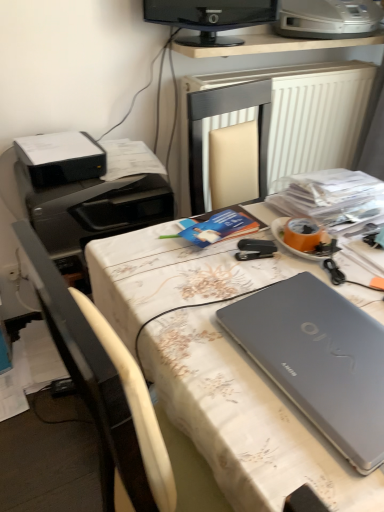
At what (x,y) coordinates should I click in order to perform the action: click on black plastic printer at upper left, arranged as the 2th printer when ordered from the bottom. Please return your answer as a coordinate pair (x, y). The width and height of the screenshot is (384, 512). Looking at the image, I should click on (61, 158).

Image resolution: width=384 pixels, height=512 pixels. What do you see at coordinates (61, 158) in the screenshot?
I see `black plastic printer at upper left, which is the third printer from right to left` at bounding box center [61, 158].

The image size is (384, 512). What are the coordinates of `white textured radiator at upper center` in the screenshot? It's located at (275, 120).

Where is `black glossy monitor at upper center`? The width and height of the screenshot is (384, 512). black glossy monitor at upper center is located at coordinates (210, 18).

Describe the element at coordinates (328, 18) in the screenshot. I see `silver metallic printer at upper right, which is counted as the 1th printer, starting from the right` at that location.

This screenshot has height=512, width=384. In order to click on white fabric-covered desk at center in this screenshot , I will do `click(244, 419)`.

Is white fabric-covered desk at center located within black plastic printer at upper left, arranged as the 2th printer when ordered from the bottom?

No, white fabric-covered desk at center is not inside black plastic printer at upper left, arranged as the 2th printer when ordered from the bottom.

Considering the sizes of objects black plastic printer at upper left, which is the third printer from right to left, and white fabric-covered desk at center in the image provided, who is shorter, black plastic printer at upper left, which is the third printer from right to left, or white fabric-covered desk at center?

With less height is black plastic printer at upper left, which is the third printer from right to left.

From a real-world perspective, is black plastic printer at upper left, which is the third printer from right to left, positioned under white fabric-covered desk at center based on gravity?

No, from a real-world perspective, black plastic printer at upper left, which is the third printer from right to left, is not beneath white fabric-covered desk at center.

Is black plastic printer at upper left, arranged as the second printer when viewed from the top, at the right side of white fabric-covered desk at center?

No.

Is silver metallic printer at upper right, which appears as the 3th printer when ordered from the bottom, positioned in front of black plastic printer at upper left, arranged as the 2th printer when ordered from the bottom?

No, it is not.

This screenshot has height=512, width=384. In the image, there is a black plastic printer at upper left, arranged as the 2th printer when ordered from the bottom. Identify the location of printer above it (from the image's perspective). (328, 18).

Between silver metallic printer at upper right, the first printer from the top, and black plastic printer at upper left, which is the 1th printer from left to right, which one has more height?

silver metallic printer at upper right, the first printer from the top.

Is black plastic printer at left, the 1th printer ordered from the bottom, positioned with its back to black plastic printer at upper left, arranged as the second printer when viewed from the top?

No, black plastic printer at left, the 1th printer ordered from the bottom, is not facing away from black plastic printer at upper left, arranged as the second printer when viewed from the top.

Based on the photo, from a real-world perspective, between black plastic printer at left, the 2th printer when ordered from left to right, and black plastic printer at upper left, which is the 1th printer from left to right, who is vertically higher?

black plastic printer at upper left, which is the 1th printer from left to right.

From the image's perspective, is black plastic printer at left, which is the second printer from right to left, above black plastic printer at upper left, which is the third printer from right to left?

Actually, black plastic printer at left, which is the second printer from right to left, appears below black plastic printer at upper left, which is the third printer from right to left, in the image.

Does point (210, 12) come closer to viewer compared to point (185, 166)?

Yes, point (210, 12) is in front of point (185, 166).

Does black glossy monitor at upper center turn towards white textured radiator at upper center?

No, black glossy monitor at upper center is not turned towards white textured radiator at upper center.

Can you confirm if black glossy monitor at upper center is thinner than white textured radiator at upper center?

Yes.

Is white fabric-covered desk at center taller or shorter than black plastic printer at upper left, which is the 1th printer from left to right?

Clearly, white fabric-covered desk at center is taller compared to black plastic printer at upper left, which is the 1th printer from left to right.

Considering the positions of point (289, 442) and point (38, 139), is point (289, 442) closer or farther from the camera than point (38, 139)?

Point (289, 442) is closer to the camera than point (38, 139).

From the image's perspective, relative to black plastic printer at upper left, which is the 1th printer from left to right, is white fabric-covered desk at center above or below?

white fabric-covered desk at center is below black plastic printer at upper left, which is the 1th printer from left to right.

Is white fabric-covered desk at center bigger than black plastic printer at upper left, which is the third printer from right to left?

Indeed, white fabric-covered desk at center has a larger size compared to black plastic printer at upper left, which is the third printer from right to left.

Where is `the 2nd printer behind the black plastic printer at left, the third printer when ordered from top to bottom, starting your count from the anchor`? the 2nd printer behind the black plastic printer at left, the third printer when ordered from top to bottom, starting your count from the anchor is located at coordinates (328, 18).

Can you confirm if silver metallic printer at upper right, which appears as the 3th printer when ordered from the bottom, is wider than black plastic printer at left, the third printer when ordered from top to bottom?

No, silver metallic printer at upper right, which appears as the 3th printer when ordered from the bottom, is not wider than black plastic printer at left, the third printer when ordered from top to bottom.

Between silver metallic printer at upper right, which is counted as the 1th printer, starting from the right, and black plastic printer at left, the 1th printer ordered from the bottom, which one has larger size?

Bigger between the two is black plastic printer at left, the 1th printer ordered from the bottom.

Consider the image. What's the angular difference between white textured radiator at upper center and black glossy monitor at upper center's facing directions?

The angular difference between white textured radiator at upper center and black glossy monitor at upper center is 14 degrees.

Which is less distant, (262, 101) or (237, 11)?

Point (262, 101) is closer to the camera than point (237, 11).

Which object is positioned more to the left, white textured radiator at upper center or black glossy monitor at upper center?

black glossy monitor at upper center is more to the left.

From a real-world perspective, does white textured radiator at upper center stand above black glossy monitor at upper center?

No, from a real-world perspective, white textured radiator at upper center is not on top of black glossy monitor at upper center.

The height and width of the screenshot is (512, 384). Find the location of `desk in front of the black plastic printer at upper left, arranged as the 2th printer when ordered from the bottom`. desk in front of the black plastic printer at upper left, arranged as the 2th printer when ordered from the bottom is located at coordinates (244, 419).

Where is `printer above the black plastic printer at upper left, arranged as the 2th printer when ordered from the bottom (from the image's perspective)`? The height and width of the screenshot is (512, 384). printer above the black plastic printer at upper left, arranged as the 2th printer when ordered from the bottom (from the image's perspective) is located at coordinates (328, 18).

When comparing their distances from black plastic printer at left, the 2th printer when ordered from left to right, does black glossy monitor at upper center or black plastic printer at upper left, arranged as the second printer when viewed from the top, seem further?

Based on the image, black glossy monitor at upper center appears to be further to black plastic printer at left, the 2th printer when ordered from left to right.

Estimate the real-world distances between objects in this image. Which object is further from silver metallic printer at upper right, which is counted as the 1th printer, starting from the right, white textured radiator at upper center or white fabric-covered desk at center?

white fabric-covered desk at center.

When comparing their distances from white fabric-covered desk at center, does silver metallic printer at upper right, the first printer from the top, or black plastic printer at left, which is the second printer from right to left, seem closer?

Based on the image, black plastic printer at left, which is the second printer from right to left, appears to be nearer to white fabric-covered desk at center.

Considering their positions, is silver metallic printer at upper right, which is counted as the 1th printer, starting from the right, positioned further to black plastic printer at left, the third printer when ordered from top to bottom, than black plastic printer at upper left, which is the 1th printer from left to right?

silver metallic printer at upper right, which is counted as the 1th printer, starting from the right, lies further to black plastic printer at left, the third printer when ordered from top to bottom, than the other object.

Looking at the image, which one is located further to silver metallic printer at upper right, which appears as the 3th printer when ordered from the bottom, black plastic printer at left, the third printer when ordered from top to bottom, or black plastic printer at upper left, arranged as the 2th printer when ordered from the bottom?

The object further to silver metallic printer at upper right, which appears as the 3th printer when ordered from the bottom, is black plastic printer at upper left, arranged as the 2th printer when ordered from the bottom.

When comparing their distances from black plastic printer at upper left, arranged as the second printer when viewed from the top, does silver metallic printer at upper right, which appears as the 3th printer when ordered from the bottom, or white fabric-covered desk at center seem further?

Among the two, silver metallic printer at upper right, which appears as the 3th printer when ordered from the bottom, is located further to black plastic printer at upper left, arranged as the second printer when viewed from the top.

When comparing their distances from white textured radiator at upper center, does white fabric-covered desk at center or silver metallic printer at upper right, the first printer from the top, seem closer?

silver metallic printer at upper right, the first printer from the top, lies closer to white textured radiator at upper center than the other object.

Based on their spatial positions, is white textured radiator at upper center or black plastic printer at left, the 1th printer ordered from the bottom, further from black glossy monitor at upper center?

The object further to black glossy monitor at upper center is black plastic printer at left, the 1th printer ordered from the bottom.

Locate an element on the screen. The height and width of the screenshot is (512, 384). printer located between black plastic printer at upper left, arranged as the 2th printer when ordered from the bottom, and silver metallic printer at upper right, the first printer from the top, in the left-right direction is located at coordinates (93, 207).

Find the location of a particular element. radiator located between black plastic printer at upper left, which is the 1th printer from left to right, and silver metallic printer at upper right, acting as the third printer starting from the left, in the left-right direction is located at coordinates (275, 120).

Locate an element on the screen. The height and width of the screenshot is (512, 384). printer that lies between black glossy monitor at upper center and black plastic printer at left, the 2th printer when ordered from left to right, from top to bottom is located at coordinates (61, 158).

Find the location of a particular element. television between black plastic printer at left, the third printer when ordered from top to bottom, and silver metallic printer at upper right, acting as the third printer starting from the left, in the horizontal direction is located at coordinates pyautogui.click(x=210, y=18).